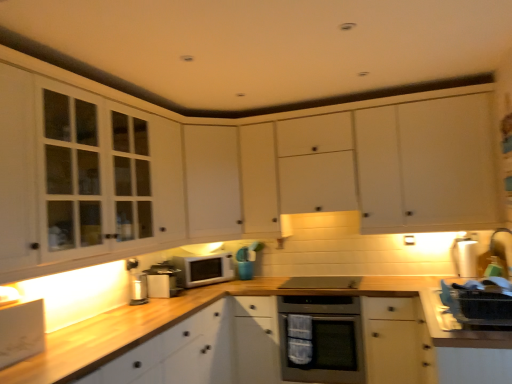
Locate an element on the screen. The image size is (512, 384). metallic silver canister at lower left, the 1th appliance in the left-to-right sequence is located at coordinates (138, 288).

In order to face metallic silver canister at lower left, which appears as the fourth appliance when viewed from the right, should I rotate leftwards or rightwards?

It's best to rotate left around 15.167 degrees.

This screenshot has width=512, height=384. Describe the element at coordinates (424, 164) in the screenshot. I see `white matte cabinet at center, arranged as the 5th cabinetry when ordered from the bottom` at that location.

This screenshot has height=384, width=512. What do you see at coordinates (212, 182) in the screenshot?
I see `white matte cabinet at center, arranged as the 2th cabinetry when ordered from the bottom` at bounding box center [212, 182].

What are the coordinates of `white glass-fronted cabinets at left, arranged as the 3th cabinetry when ordered from the bottom` in the screenshot? It's located at (82, 178).

The image size is (512, 384). Describe the element at coordinates (123, 332) in the screenshot. I see `wooden at center` at that location.

Where is `satin silver oven at center`? This screenshot has width=512, height=384. satin silver oven at center is located at coordinates (321, 339).

Do you think white glossy water filter at right, which is the 1th appliance in right-to-left order, is within metallic silver toaster at center, which is counted as the second appliance, starting from the left, or outside of it?

The correct answer is: outside.

Considering the relative positions of white glossy water filter at right, the fourth appliance positioned from the left, and metallic silver toaster at center, the 3th appliance in the right-to-left sequence, in the image provided, is white glossy water filter at right, the fourth appliance positioned from the left, to the left or to the right of metallic silver toaster at center, the 3th appliance in the right-to-left sequence,?

From the image, it's evident that white glossy water filter at right, the fourth appliance positioned from the left, is to the right of metallic silver toaster at center, the 3th appliance in the right-to-left sequence.

Is white glossy water filter at right, the fourth appliance positioned from the left, oriented towards metallic silver toaster at center, which is counted as the second appliance, starting from the left?

No, white glossy water filter at right, the fourth appliance positioned from the left, is not facing towards metallic silver toaster at center, which is counted as the second appliance, starting from the left.

In terms of size, does white glossy water filter at right, the fourth appliance positioned from the left, appear bigger or smaller than metallic silver toaster at center, the 3th appliance in the right-to-left sequence?

Clearly, white glossy water filter at right, the fourth appliance positioned from the left, is smaller in size than metallic silver toaster at center, the 3th appliance in the right-to-left sequence.

Is white matte cabinet at center, which ranks as the fourth cabinetry in bottom-to-top order, far away from white matte cabinet at center, which ranks as the 1th cabinetry in top-to-bottom order?

No, there isn't a large distance between white matte cabinet at center, which ranks as the fourth cabinetry in bottom-to-top order, and white matte cabinet at center, which ranks as the 1th cabinetry in top-to-bottom order.

Based on their positions, is white matte cabinet at center, marked as the second cabinetry in a top-to-bottom arrangement, located to the left or right of white matte cabinet at center, which ranks as the 1th cabinetry in top-to-bottom order?

Clearly, white matte cabinet at center, marked as the second cabinetry in a top-to-bottom arrangement, is on the left of white matte cabinet at center, which ranks as the 1th cabinetry in top-to-bottom order, in the image.

Consider the image. Which of these two, white matte cabinet at center, which ranks as the fourth cabinetry in bottom-to-top order, or white matte cabinet at center, arranged as the 5th cabinetry when ordered from the bottom, stands shorter?

With less height is white matte cabinet at center, arranged as the 5th cabinetry when ordered from the bottom.

Is white matte cabinet at center, arranged as the 5th cabinetry when ordered from the bottom, positioned with its back to metallic silver canister at lower left, which appears as the fourth appliance when viewed from the right?

No, metallic silver canister at lower left, which appears as the fourth appliance when viewed from the right, is not at the back of white matte cabinet at center, arranged as the 5th cabinetry when ordered from the bottom.

From a real-world perspective, is white matte cabinet at center, arranged as the 5th cabinetry when ordered from the bottom, on top of metallic silver canister at lower left, which appears as the fourth appliance when viewed from the right?

Correct, in the physical world, white matte cabinet at center, arranged as the 5th cabinetry when ordered from the bottom, is higher than metallic silver canister at lower left, which appears as the fourth appliance when viewed from the right.

From the image's perspective, would you say white matte cabinet at center, arranged as the 5th cabinetry when ordered from the bottom, is shown under metallic silver canister at lower left, the 1th appliance in the left-to-right sequence?

Actually, white matte cabinet at center, arranged as the 5th cabinetry when ordered from the bottom, appears above metallic silver canister at lower left, the 1th appliance in the left-to-right sequence, in the image.

Who is shorter, white matte cabinet at center, which ranks as the 1th cabinetry in top-to-bottom order, or metallic silver canister at lower left, which appears as the fourth appliance when viewed from the right?

Standing shorter between the two is metallic silver canister at lower left, which appears as the fourth appliance when viewed from the right.

Is metallic silver toaster at center, which is counted as the second appliance, starting from the left, surrounded by white glass-fronted cabinets at left, which is the third cabinetry from top to bottom?

That's incorrect, metallic silver toaster at center, which is counted as the second appliance, starting from the left, is not inside white glass-fronted cabinets at left, which is the third cabinetry from top to bottom.

Is white glass-fronted cabinets at left, arranged as the 3th cabinetry when ordered from the bottom, facing towards metallic silver toaster at center, the 3th appliance in the right-to-left sequence?

No, white glass-fronted cabinets at left, arranged as the 3th cabinetry when ordered from the bottom, is not facing towards metallic silver toaster at center, the 3th appliance in the right-to-left sequence.

Is point (130, 245) closer or farther from the camera than point (162, 268)?

Point (130, 245) is closer to the camera than point (162, 268).

Is white wood cabinet at lower left, positioned as the first cabinetry in bottom-to-top order, to the left of metallic silver toaster at center, the 3th appliance in the right-to-left sequence, from the viewer's perspective?

Indeed, white wood cabinet at lower left, positioned as the first cabinetry in bottom-to-top order, is positioned on the left side of metallic silver toaster at center, the 3th appliance in the right-to-left sequence.

Considering the relative sizes of white wood cabinet at lower left, which appears as the 5th cabinetry when viewed from the top, and metallic silver toaster at center, the 3th appliance in the right-to-left sequence, in the image provided, is white wood cabinet at lower left, which appears as the 5th cabinetry when viewed from the top, thinner than metallic silver toaster at center, the 3th appliance in the right-to-left sequence,?

No.

From the image's perspective, starting from the white wood cabinet at lower left, which appears as the 5th cabinetry when viewed from the top, which appliance is the 3rd one above? Please provide its 2D coordinates.

[(162, 280)]

Does white wood cabinet at lower left, positioned as the first cabinetry in bottom-to-top order, have a smaller size compared to metallic silver toaster at center, which is counted as the second appliance, starting from the left?

Actually, white wood cabinet at lower left, positioned as the first cabinetry in bottom-to-top order, might be larger than metallic silver toaster at center, which is counted as the second appliance, starting from the left.

From a real-world perspective, which is physically below, metallic silver toaster at center, the 3th appliance in the right-to-left sequence, or white glass-fronted cabinets at left, which is the third cabinetry from top to bottom?

metallic silver toaster at center, the 3th appliance in the right-to-left sequence.

Does metallic silver toaster at center, the 3th appliance in the right-to-left sequence, lie in front of white glass-fronted cabinets at left, which is the third cabinetry from top to bottom?

No, metallic silver toaster at center, the 3th appliance in the right-to-left sequence, is further to the viewer.

Visually, is metallic silver toaster at center, the 3th appliance in the right-to-left sequence, positioned to the left or to the right of white glass-fronted cabinets at left, arranged as the 3th cabinetry when ordered from the bottom?

From the image, it's evident that metallic silver toaster at center, the 3th appliance in the right-to-left sequence, is to the right of white glass-fronted cabinets at left, arranged as the 3th cabinetry when ordered from the bottom.

Based on the photo, how different are the orientations of metallic silver toaster at center, which is counted as the second appliance, starting from the left, and white glass-fronted cabinets at left, arranged as the 3th cabinetry when ordered from the bottom, in degrees?

4.46 degrees separate the facing orientations of metallic silver toaster at center, which is counted as the second appliance, starting from the left, and white glass-fronted cabinets at left, arranged as the 3th cabinetry when ordered from the bottom.

Is satin black stove at center, the second appliance when ordered from right to left, facing away from white glossy water filter at right, which is the 1th appliance in right-to-left order?

No.

From the image's perspective, which is below, satin black stove at center, the second appliance when ordered from right to left, or white glossy water filter at right, the fourth appliance positioned from the left?

From the image's view, satin black stove at center, the second appliance when ordered from right to left, is below.

Are satin black stove at center, the 3th appliance from the left, and white glossy water filter at right, the fourth appliance positioned from the left, beside each other?

No, satin black stove at center, the 3th appliance from the left, is not with white glossy water filter at right, the fourth appliance positioned from the left.

Who is smaller, satin black stove at center, the 3th appliance from the left, or white glossy water filter at right, which is the 1th appliance in right-to-left order?

With smaller size is white glossy water filter at right, which is the 1th appliance in right-to-left order.

Find the location of `appliance above the metallic silver toaster at center, which is counted as the second appliance, starting from the left (from a real-world perspective)`. appliance above the metallic silver toaster at center, which is counted as the second appliance, starting from the left (from a real-world perspective) is located at coordinates (465, 257).

Find the location of `the 3rd cabinetry behind the white matte cabinet at center, marked as the second cabinetry in a top-to-bottom arrangement`. the 3rd cabinetry behind the white matte cabinet at center, marked as the second cabinetry in a top-to-bottom arrangement is located at coordinates (424, 164).

Looking at the image, which one is located closer to white wood cabinet at lower left, positioned as the first cabinetry in bottom-to-top order, white matte cabinet at center, which ranks as the 1th cabinetry in top-to-bottom order, or satin black stove at center, the 3th appliance from the left?

Based on the image, satin black stove at center, the 3th appliance from the left, appears to be nearer to white wood cabinet at lower left, positioned as the first cabinetry in bottom-to-top order.

Looking at the image, which one is located closer to white glossy water filter at right, the fourth appliance positioned from the left, white wood cabinet at lower left, which appears as the 5th cabinetry when viewed from the top, or satin silver oven at center?

satin silver oven at center is positioned closer to the anchor white glossy water filter at right, the fourth appliance positioned from the left.

When comparing their distances from satin black stove at center, the 3th appliance from the left, does white glass-fronted cabinets at left, which is the third cabinetry from top to bottom, or white matte cabinet at center, arranged as the 5th cabinetry when ordered from the bottom, seem further?

white glass-fronted cabinets at left, which is the third cabinetry from top to bottom.

Considering their positions, is satin black stove at center, the second appliance when ordered from right to left, positioned closer to satin silver oven at center than white matte cabinet at center, arranged as the 2th cabinetry when ordered from the bottom?

The object closer to satin silver oven at center is satin black stove at center, the second appliance when ordered from right to left.

Based on their spatial positions, is satin silver oven at center or white glass-fronted cabinets at left, which is the third cabinetry from top to bottom, further from white matte microwave at center?

white glass-fronted cabinets at left, which is the third cabinetry from top to bottom, is positioned further to the anchor white matte microwave at center.

Which object lies nearer to the anchor point white wood cabinet at lower left, which appears as the 5th cabinetry when viewed from the top, metallic silver toaster at center, which is counted as the second appliance, starting from the left, or white matte cabinet at center, arranged as the 2th cabinetry when ordered from the bottom?

metallic silver toaster at center, which is counted as the second appliance, starting from the left, is positioned closer to the anchor white wood cabinet at lower left, which appears as the 5th cabinetry when viewed from the top.

Looking at the image, which one is located further to white wood cabinet at lower left, positioned as the first cabinetry in bottom-to-top order, white glossy water filter at right, the fourth appliance positioned from the left, or satin silver oven at center?

Among the two, white glossy water filter at right, the fourth appliance positioned from the left, is located further to white wood cabinet at lower left, positioned as the first cabinetry in bottom-to-top order.

Considering their positions, is white matte cabinet at center, which ranks as the 1th cabinetry in top-to-bottom order, positioned further to metallic silver toaster at center, which is counted as the second appliance, starting from the left, than white glass-fronted cabinets at left, arranged as the 3th cabinetry when ordered from the bottom?

white matte cabinet at center, which ranks as the 1th cabinetry in top-to-bottom order.

Where is `home appliance between white matte cabinet at center, marked as the second cabinetry in a top-to-bottom arrangement, and metallic silver toaster at center, which is counted as the second appliance, starting from the left, in the front-back direction`? The height and width of the screenshot is (384, 512). home appliance between white matte cabinet at center, marked as the second cabinetry in a top-to-bottom arrangement, and metallic silver toaster at center, which is counted as the second appliance, starting from the left, in the front-back direction is located at coordinates (321, 339).

Where is `home appliance located between white matte cabinet at center, marked as the second cabinetry in a top-to-bottom arrangement, and white matte microwave at center in the depth direction`? The height and width of the screenshot is (384, 512). home appliance located between white matte cabinet at center, marked as the second cabinetry in a top-to-bottom arrangement, and white matte microwave at center in the depth direction is located at coordinates (321, 339).

Where is `home appliance between white matte cabinet at center, marked as the second cabinetry in a top-to-bottom arrangement, and satin black stove at center, the 3th appliance from the left, along the z-axis`? The height and width of the screenshot is (384, 512). home appliance between white matte cabinet at center, marked as the second cabinetry in a top-to-bottom arrangement, and satin black stove at center, the 3th appliance from the left, along the z-axis is located at coordinates (321, 339).

This screenshot has height=384, width=512. In order to click on microwave oven situated between white wood cabinet at lower left, positioned as the first cabinetry in bottom-to-top order, and white glossy water filter at right, the fourth appliance positioned from the left, from left to right in this screenshot , I will do `click(203, 269)`.